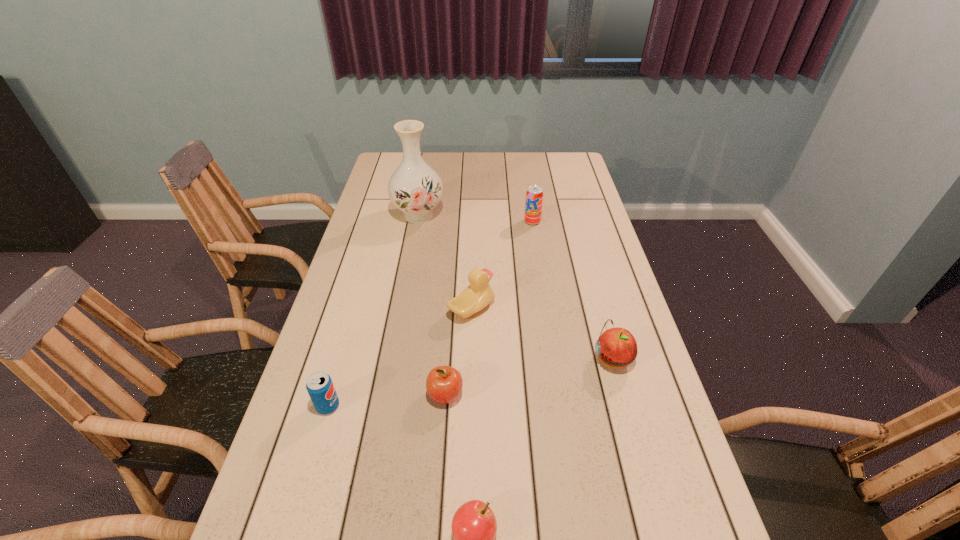
At what (x,y) coordinates should I click in order to perform the action: click on vacant space at the left edge. Please return your answer as a coordinate pair (x, y). The image size is (960, 540). Looking at the image, I should click on (345, 442).

This screenshot has height=540, width=960. In the image, there is a desktop. What are the coordinates of `free region at the right edge` in the screenshot? It's located at (657, 395).

In order to click on vacant space at the far right corner in this screenshot , I will do `click(564, 165)`.

Locate an element on the screen. This screenshot has height=540, width=960. free spot between the farther soda can and the fifth nearest object is located at coordinates (502, 265).

I want to click on empty space between the second farthest apple and the tallest object, so click(432, 306).

I want to click on vacant area that lies between the sixth object from right to left and the right soda can, so click(475, 219).

Where is `vacant space in between the right soda can and the fourth farthest object`? vacant space in between the right soda can and the fourth farthest object is located at coordinates (572, 290).

Image resolution: width=960 pixels, height=540 pixels. I want to click on object that is the fourth nearest to the duck, so click(x=321, y=390).

Identify which object is the second closest to the second farthest apple. Please provide its 2D coordinates. Your answer should be formatted as a tuple, i.e. [(x, y)], where the tuple contains the x and y coordinates of a point satisfying the conditions above.

[(321, 390)]

Locate which apple ranks second in proximity to the second nearest apple. Please provide its 2D coordinates. Your answer should be formatted as a tuple, i.e. [(x, y)], where the tuple contains the x and y coordinates of a point satisfying the conditions above.

[(617, 347)]